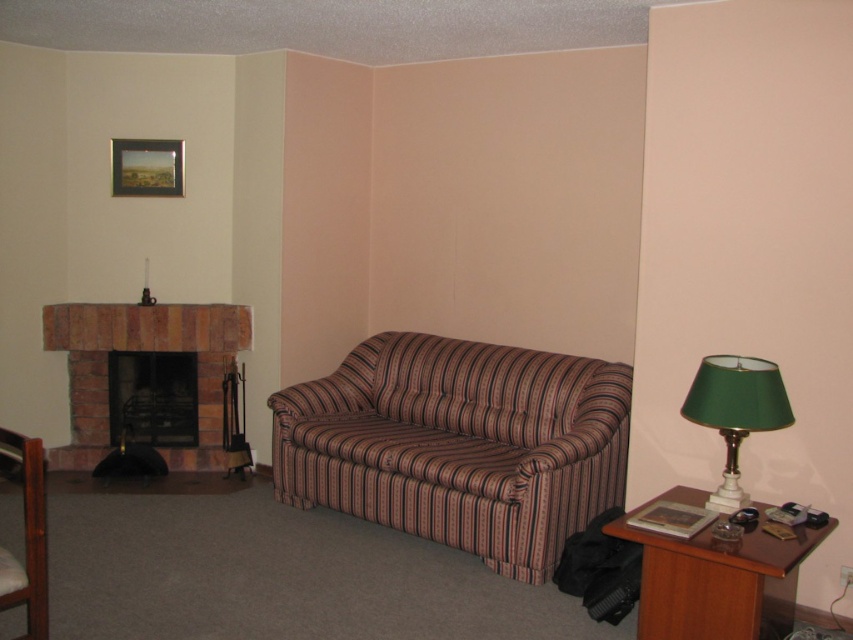
Between point (376, 515) and point (709, 371), which one is positioned behind?

The point (376, 515) is more distant.

Which is above, striped fabric couch at center or green fabric lampshade at right?

green fabric lampshade at right is above.

Between point (448, 480) and point (737, 365), which one is positioned in front?

Point (737, 365) is in front.

Identify the location of striped fabric couch at center. This screenshot has width=853, height=640. (459, 444).

Who is more distant from viewer, [659,566] or [7,564]?

Positioned behind is point [659,566].

Is brown wood side table at lower right above wooden armchair at lower left?

Actually, brown wood side table at lower right is below wooden armchair at lower left.

Does point (698, 541) come closer to viewer compared to point (9, 449)?

No, it is not.

Locate an element on the screen. brown wood side table at lower right is located at coordinates (715, 577).

Who is positioned more to the left, striped fabric couch at center or wooden picture frame at upper left?

wooden picture frame at upper left

Can you confirm if striped fabric couch at center is positioned to the left of wooden picture frame at upper left?

In fact, striped fabric couch at center is to the right of wooden picture frame at upper left.

Does point (500, 524) come in front of point (171, 173)?

Yes, it is.

The height and width of the screenshot is (640, 853). What are the coordinates of `striped fabric couch at center` in the screenshot? It's located at (459, 444).